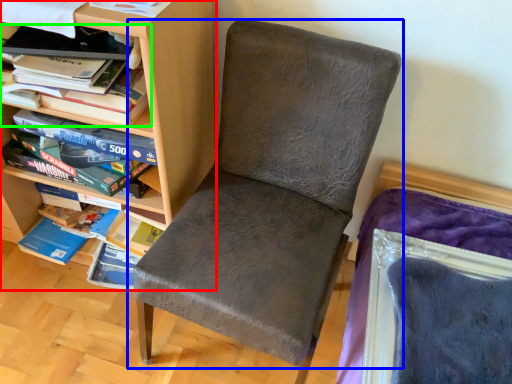
Question: Which object is the farthest from shelf (highlighted by a red box)? Choose among these: chair (highlighted by a blue box) or book (highlighted by a green box).

Choices:
 (A) chair
 (B) book

Answer: (A)